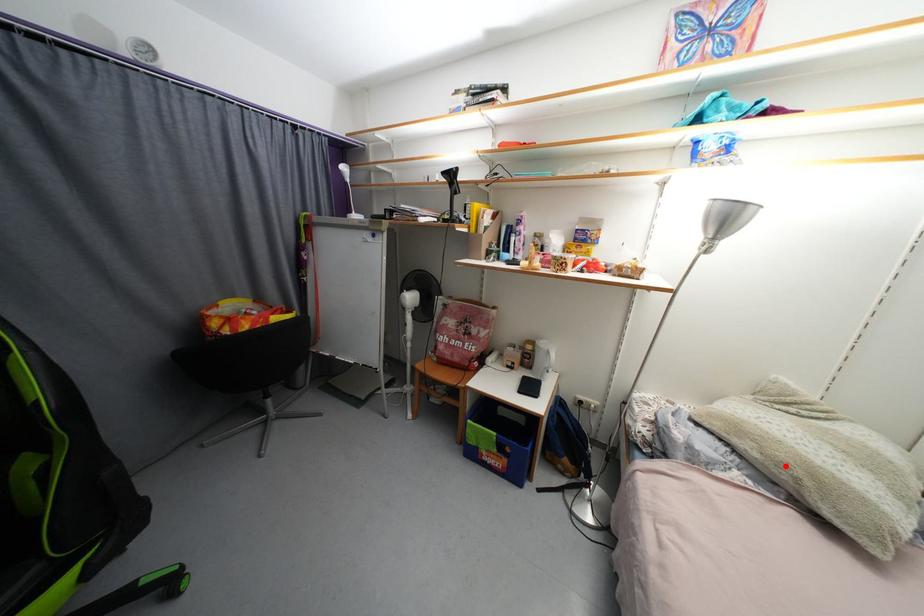
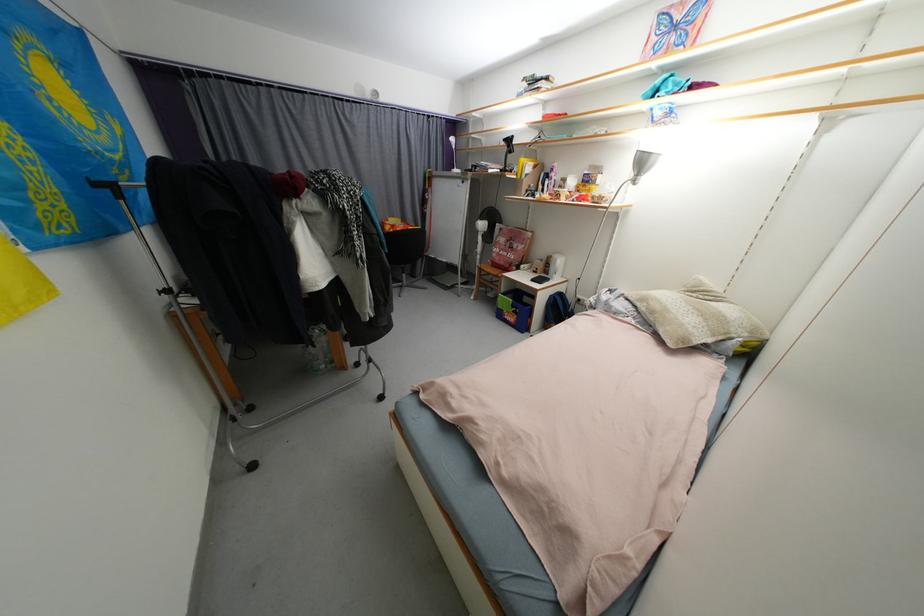
The point at the highlighted location is marked in the first image. Where is the corresponding point in the second image?

(658, 314)